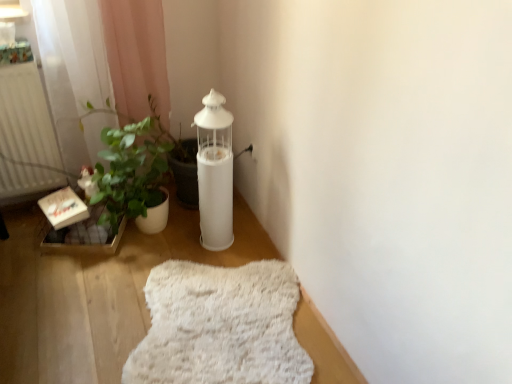
Question: From the image's perspective, is white matte oil lamp at center positioned above or below white fluffy rug at lower center?

Choices:
 (A) above
 (B) below

Answer: (A)

Question: Would you say white matte oil lamp at center is to the left or to the right of white fluffy rug at lower center in the picture?

Choices:
 (A) right
 (B) left

Answer: (B)

Question: Which is nearer to the white matte radiator at left?

Choices:
 (A) white fluffy rug at lower center
 (B) white matte oil lamp at center
 (C) wooden crate at lower left

Answer: (C)

Question: Considering the real-world distances, which object is closest to the wooden crate at lower left?

Choices:
 (A) white matte oil lamp at center
 (B) white fluffy rug at lower center
 (C) white matte radiator at left

Answer: (C)